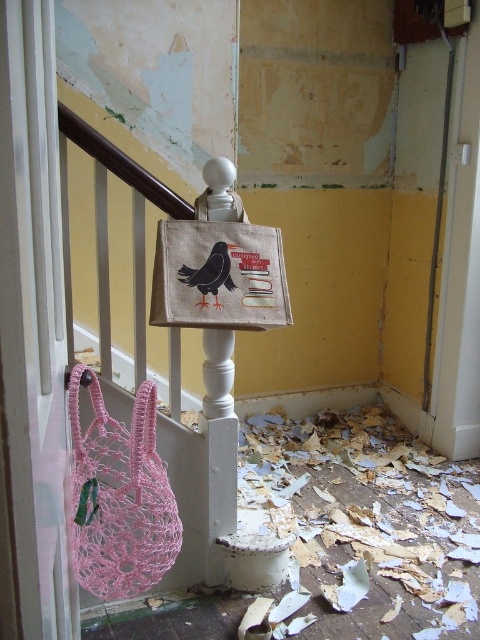
Question: Estimate the real-world distances between objects in this image. Which object is closer to the canvas bird-patterned bag at center?

Choices:
 (A) matte black bird at center
 (B) pink crochet bag at lower left

Answer: (A)

Question: Which object appears closest to the camera in this image?

Choices:
 (A) pink crochet bag at lower left
 (B) matte black bird at center
 (C) canvas bird-patterned bag at center

Answer: (A)

Question: Does canvas bird-patterned bag at center appear on the left side of matte black bird at center?

Choices:
 (A) no
 (B) yes

Answer: (A)

Question: Does pink crochet bag at lower left have a smaller size compared to matte black bird at center?

Choices:
 (A) yes
 (B) no

Answer: (B)

Question: Does pink crochet bag at lower left have a greater width compared to canvas bird-patterned bag at center?

Choices:
 (A) no
 (B) yes

Answer: (A)

Question: Which is farther from the matte black bird at center?

Choices:
 (A) canvas bird-patterned bag at center
 (B) pink crochet bag at lower left

Answer: (B)